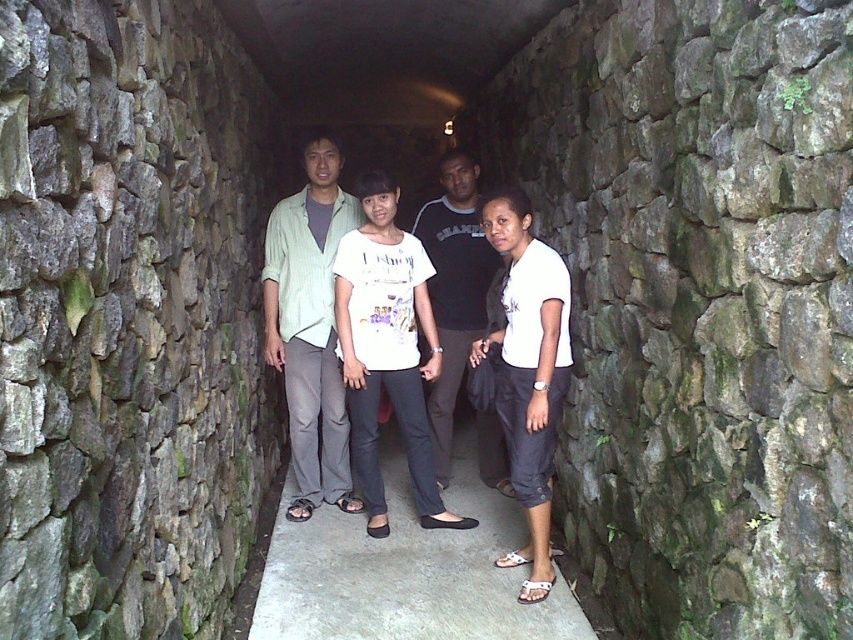
Question: Does light green fabric shirt at center have a lesser width compared to black cotton shirt at center?

Choices:
 (A) no
 (B) yes

Answer: (A)

Question: Can you confirm if light green fabric shirt at center is positioned below black cotton shirt at center?

Choices:
 (A) yes
 (B) no

Answer: (B)

Question: Which point is farther from the camera taking this photo?

Choices:
 (A) (341, 472)
 (B) (552, 307)
 (C) (438, 332)

Answer: (C)

Question: Among these points, which one is farthest from the camera?

Choices:
 (A) (334, 205)
 (B) (520, 218)

Answer: (A)

Question: Can you confirm if light green fabric shirt at center is wider than white cotton shirt at center?

Choices:
 (A) yes
 (B) no

Answer: (A)

Question: Which point is farther to the camera?

Choices:
 (A) (459, 177)
 (B) (306, 396)
 (C) (519, 412)

Answer: (A)